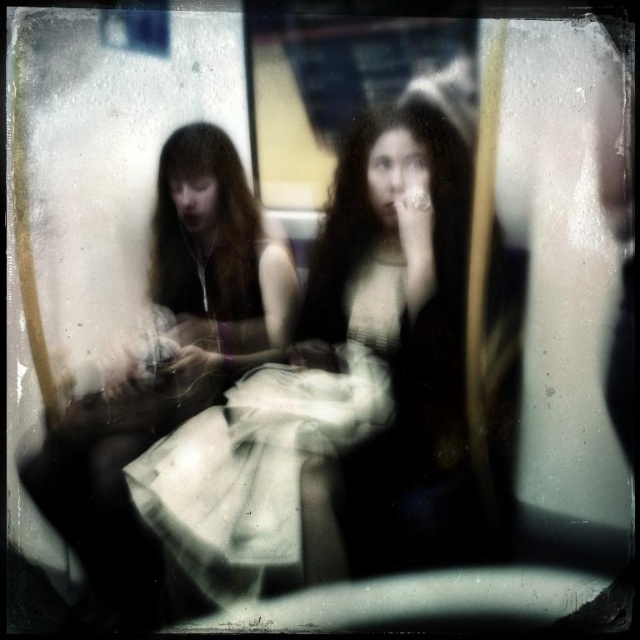
Is white fabric dress at center to the left of white cotton dress at center from the viewer's perspective?

In fact, white fabric dress at center is to the right of white cotton dress at center.

Is point (259, 486) positioned behind point (141, 563)?

Yes, point (259, 486) is farther from viewer.

Where is `white fabric dress at center`? white fabric dress at center is located at coordinates (342, 388).